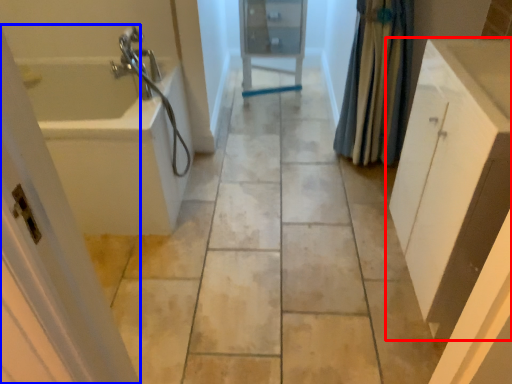
Question: Among these objects, which one is nearest to the camera, bathroom cabinet (highlighted by a red box) or screen door (highlighted by a blue box)?

Choices:
 (A) bathroom cabinet
 (B) screen door

Answer: (B)